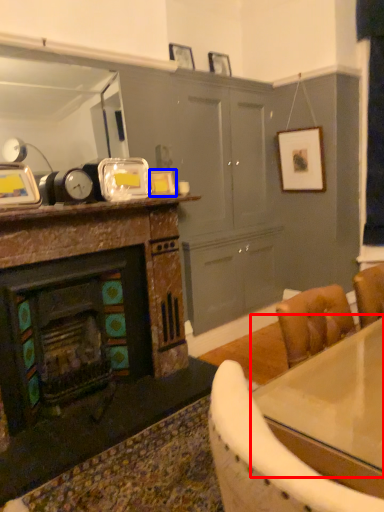
Question: Which object appears farthest to the camera in this image, counter top (highlighted by a red box) or picture frame (highlighted by a blue box)?

Choices:
 (A) counter top
 (B) picture frame

Answer: (B)